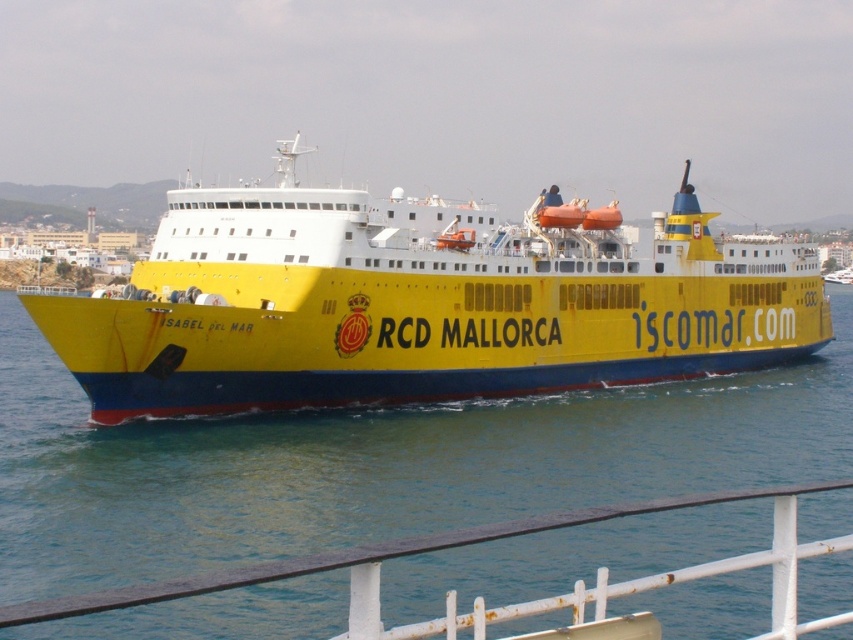
Which of these two, yellow matte ship at center or white metal railing at lower center, stands taller?

yellow matte ship at center

Can you confirm if yellow matte ship at center is bigger than white metal railing at lower center?

Correct, yellow matte ship at center is larger in size than white metal railing at lower center.

Is point (190, 308) farther from camera compared to point (302, 560)?

Yes, point (190, 308) is behind point (302, 560).

This screenshot has height=640, width=853. I want to click on yellow matte ship at center, so 421,304.

Where is `yellow matte ship at center`? yellow matte ship at center is located at coordinates (421, 304).

Describe the element at coordinates (421, 304) in the screenshot. I see `yellow matte ship at center` at that location.

The height and width of the screenshot is (640, 853). I want to click on yellow matte ship at center, so click(421, 304).

Does blue water at center have a greater height compared to white metal railing at lower center?

Incorrect, blue water at center's height is not larger of white metal railing at lower center's.

Can you confirm if blue water at center is positioned above white metal railing at lower center?

Correct, blue water at center is located above white metal railing at lower center.

Find the location of a particular element. blue water at center is located at coordinates (370, 465).